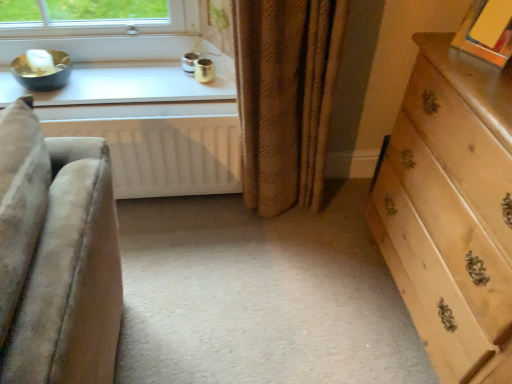
Question: Can you confirm if white glossy window sill at upper left is wider than white matte radiator at lower center?

Choices:
 (A) no
 (B) yes

Answer: (B)

Question: Is the position of white glossy window sill at upper left more distant than that of white matte radiator at lower center?

Choices:
 (A) yes
 (B) no

Answer: (A)

Question: Does white glossy window sill at upper left appear on the right side of white matte radiator at lower center?

Choices:
 (A) yes
 (B) no

Answer: (B)

Question: Is white glossy window sill at upper left positioned before white matte radiator at lower center?

Choices:
 (A) yes
 (B) no

Answer: (B)

Question: Could you tell me if white glossy window sill at upper left is turned towards white matte radiator at lower center?

Choices:
 (A) yes
 (B) no

Answer: (A)

Question: Considering their positions, is white matte radiator at lower center located in front of or behind brown textured curtain at center?

Choices:
 (A) behind
 (B) front

Answer: (A)

Question: Looking at their shapes, would you say white matte radiator at lower center is wider or thinner than brown textured curtain at center?

Choices:
 (A) wide
 (B) thin

Answer: (B)

Question: Is white matte radiator at lower center spatially inside brown textured curtain at center, or outside of it?

Choices:
 (A) outside
 (B) inside

Answer: (A)

Question: From the image's perspective, is white matte radiator at lower center located above or below brown textured curtain at center?

Choices:
 (A) below
 (B) above

Answer: (A)

Question: Is point (249, 104) positioned closer to the camera than point (110, 132)?

Choices:
 (A) closer
 (B) farther

Answer: (A)

Question: From a real-world perspective, is brown textured curtain at center positioned above or below white matte radiator at lower center?

Choices:
 (A) below
 (B) above

Answer: (B)

Question: From the image's perspective, is brown textured curtain at center positioned above or below white matte radiator at lower center?

Choices:
 (A) below
 (B) above

Answer: (B)

Question: Considering the positions of brown textured curtain at center and white matte radiator at lower center in the image, is brown textured curtain at center taller or shorter than white matte radiator at lower center?

Choices:
 (A) short
 (B) tall

Answer: (B)

Question: In terms of height, does light wood dresser at right look taller or shorter compared to brown textured curtain at center?

Choices:
 (A) short
 (B) tall

Answer: (B)

Question: Based on their positions, is light wood dresser at right located to the left or right of brown textured curtain at center?

Choices:
 (A) right
 (B) left

Answer: (A)